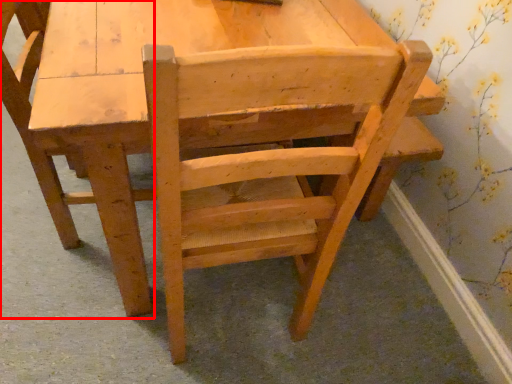
Question: From the image's perspective, where is chair (annotated by the red box) located in relation to chair in the image?

Choices:
 (A) below
 (B) above

Answer: (B)